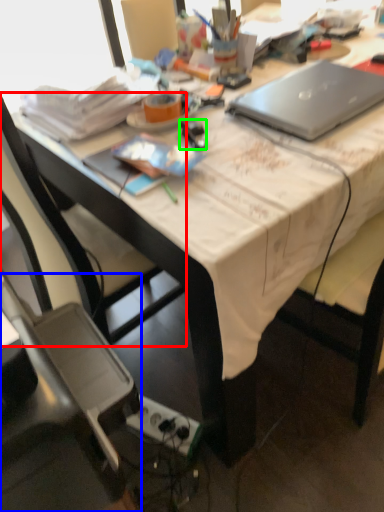
Question: Which object is positioned closest to chair (highlighted by a red box)? Select from chair (highlighted by a blue box) and stationery (highlighted by a green box).

Choices:
 (A) chair
 (B) stationery

Answer: (A)